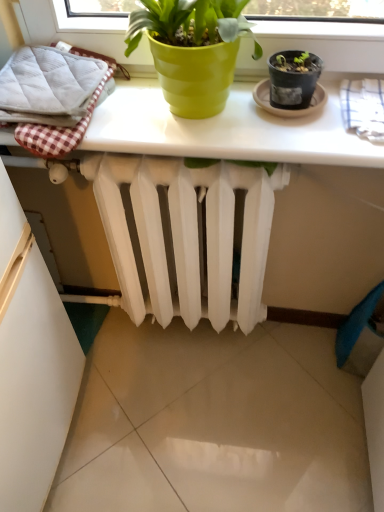
In order to click on blank space situated above white quilted bath towel at left, acting as the 1th bath towel starting from the left (from a real-world perspective) in this screenshot , I will do `click(49, 80)`.